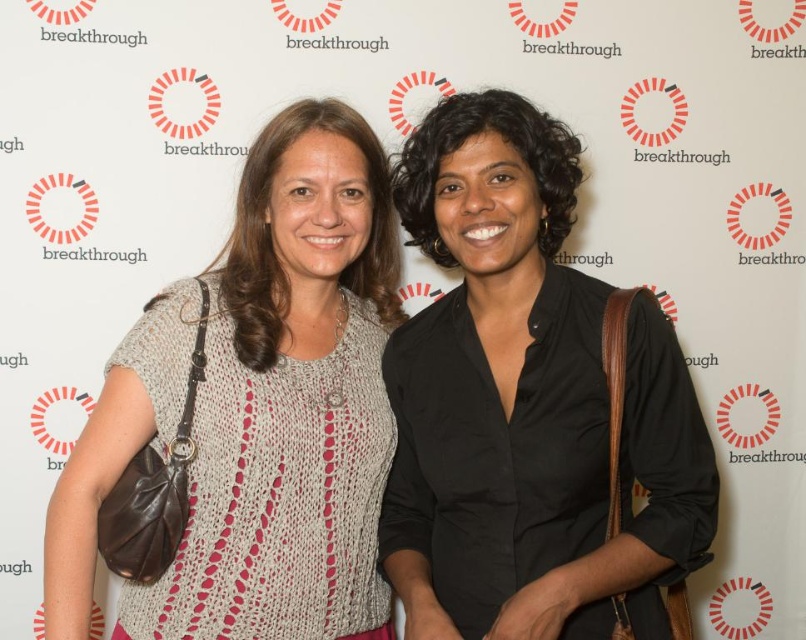
Question: Does black matte shirt at center have a larger size compared to knitted beige sweater at center?

Choices:
 (A) no
 (B) yes

Answer: (A)

Question: Where is black matte shirt at center located in relation to knitted beige sweater at center in the image?

Choices:
 (A) above
 (B) below

Answer: (A)

Question: Which point is closer to the camera taking this photo?

Choices:
 (A) (563, 353)
 (B) (202, 396)

Answer: (A)

Question: Is black matte shirt at center positioned before knitted beige sweater at center?

Choices:
 (A) no
 (B) yes

Answer: (B)

Question: Which of the following is the farthest from the observer?

Choices:
 (A) (48, 596)
 (B) (397, 186)

Answer: (B)